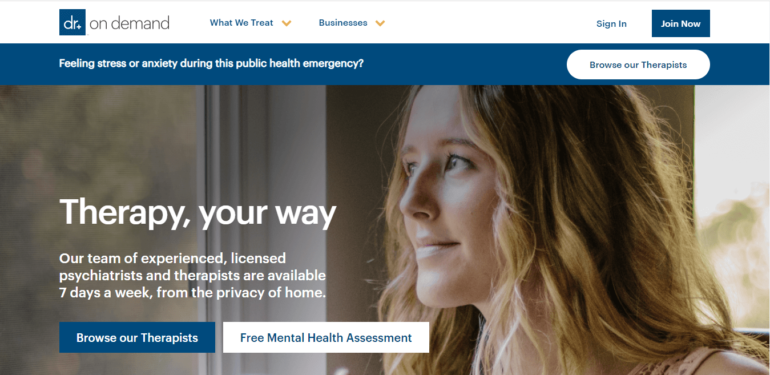
You are a GUI agent. You are given a task and a screenshot of the screen. Output one action in this format:
    pyautogui.click(x=<x>, y=<y>)
    Task: Click on the window
    The width and height of the screenshot is (770, 375).
    Given the screenshot: What is the action you would take?
    pos(102,177)